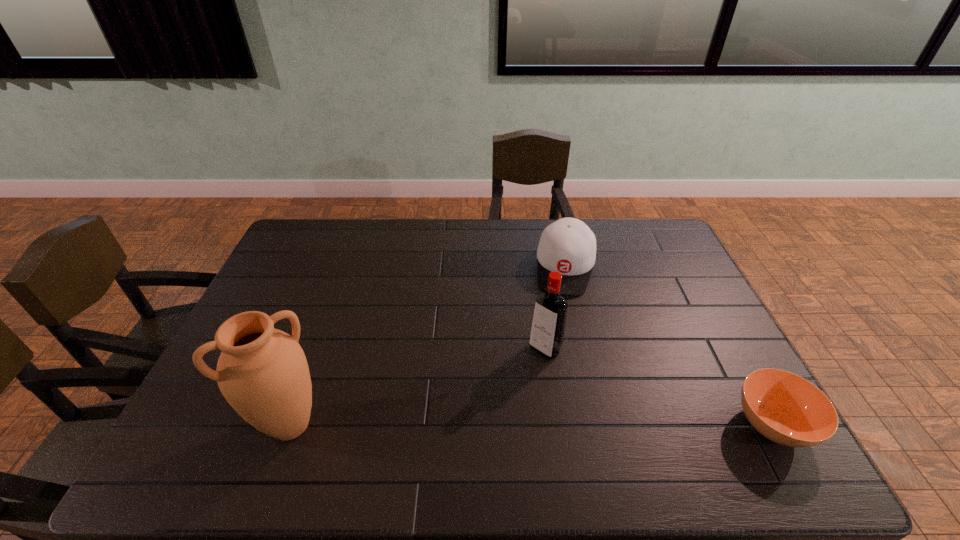
You are a GUI agent. You are given a task and a screenshot of the screen. Output one action in this format:
    pyautogui.click(x=<x>, y=<y>)
    Task: Click on the object situated at the near right corner
    
    Given the screenshot: What is the action you would take?
    pyautogui.click(x=785, y=408)

Where is `free space at the far edge of the desktop`? free space at the far edge of the desktop is located at coordinates (372, 220).

What are the coordinates of `vacant space at the near edge of the desktop` in the screenshot? It's located at (497, 413).

The width and height of the screenshot is (960, 540). Identify the location of free region at the left edge of the desktop. (271, 296).

Where is `free region at the right edge of the desktop`? The height and width of the screenshot is (540, 960). free region at the right edge of the desktop is located at coordinates (673, 289).

Find the location of a particular element. This screenshot has width=960, height=540. vacant point at the far left corner is located at coordinates (323, 237).

Locate an element on the screen. The width and height of the screenshot is (960, 540). vacant space that is in between the second farthest object and the leftmost object is located at coordinates (418, 387).

Where is `free space between the second farthest object and the urn`? The image size is (960, 540). free space between the second farthest object and the urn is located at coordinates (418, 387).

Locate an element on the screen. Image resolution: width=960 pixels, height=540 pixels. empty space between the soup bowl and the urn is located at coordinates click(532, 425).

I want to click on free spot between the third nearest object and the rightmost object, so click(x=659, y=387).